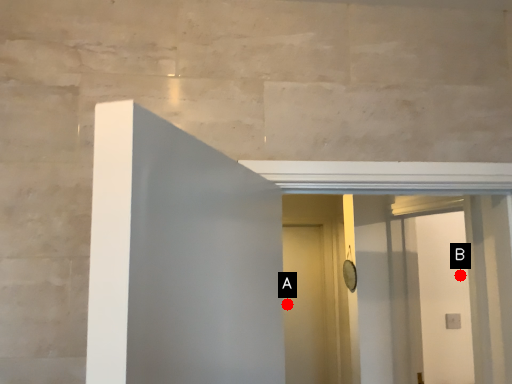
Question: Two points are circled on the image, labeled by A and B beside each circle. Which point is closer to the camera taking this photo?

Choices:
 (A) A is closer
 (B) B is closer

Answer: (B)